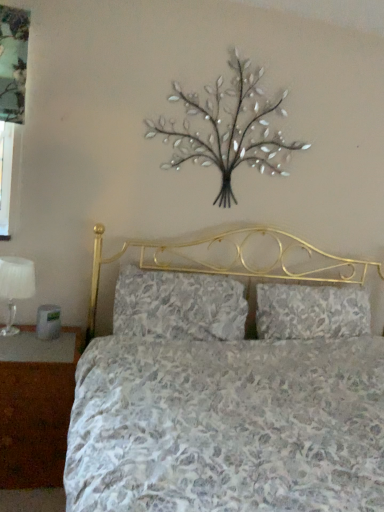
The width and height of the screenshot is (384, 512). I want to click on floral fabric pillow at center, which is counted as the first pillow, starting from the left, so click(178, 305).

This screenshot has height=512, width=384. I want to click on floral fabric pillow at center, placed as the second pillow when sorted from left to right, so click(x=311, y=311).

How distant is white fabric lampshade at left from metallic gray alarm clock at left?

7.32 inches.

Is white fabric lampshade at left far away from metallic gray alarm clock at left?

No, white fabric lampshade at left is not far from metallic gray alarm clock at left.

Find the location of a particular element. The width and height of the screenshot is (384, 512). silver below the white fabric lampshade at left (from the image's perspective) is located at coordinates (48, 322).

From the image's perspective, is white fabric lampshade at left under metallic gray alarm clock at left?

No, from the image's perspective, white fabric lampshade at left is not beneath metallic gray alarm clock at left.

From the picture: Is floral fabric pillow at center, placed as the second pillow when sorted from left to right, far from metallic silver tree at upper center?

floral fabric pillow at center, placed as the second pillow when sorted from left to right, is near metallic silver tree at upper center, not far away.

Is floral fabric pillow at center, the 1th pillow viewed from the right, bigger or smaller than metallic silver tree at upper center?

floral fabric pillow at center, the 1th pillow viewed from the right, is bigger than metallic silver tree at upper center.

Image resolution: width=384 pixels, height=512 pixels. What are the coordinates of `flower lying above the floral fabric pillow at center, placed as the second pillow when sorted from left to right (from the image's perspective)` in the screenshot? It's located at (228, 129).

Is the position of floral fabric pillow at center, placed as the second pillow when sorted from left to right, more distant than that of metallic silver tree at upper center?

Yes, it is behind metallic silver tree at upper center.

Which of these two, floral fabric pillow at center, the 1th pillow viewed from the right, or metallic gray alarm clock at left, is bigger?

floral fabric pillow at center, the 1th pillow viewed from the right.

Does floral fabric pillow at center, placed as the second pillow when sorted from left to right, have a greater height compared to metallic gray alarm clock at left?

Correct, floral fabric pillow at center, placed as the second pillow when sorted from left to right, is much taller as metallic gray alarm clock at left.

Could you tell me if floral fabric pillow at center, the 1th pillow viewed from the right, is turned towards metallic gray alarm clock at left?

No, floral fabric pillow at center, the 1th pillow viewed from the right, is not aimed at metallic gray alarm clock at left.

From the picture: Is floral fabric pillow at center, which is counted as the first pillow, starting from the left, far away from metallic silver tree at upper center?

floral fabric pillow at center, which is counted as the first pillow, starting from the left, is actually quite close to metallic silver tree at upper center.

From a real-world perspective, which is physically below, floral fabric pillow at center, which is counted as the first pillow, starting from the left, or metallic silver tree at upper center?

From a 3D spatial view, floral fabric pillow at center, which is counted as the first pillow, starting from the left, is below.

Considering the relative positions of floral fabric pillow at center, the second pillow from the right, and metallic silver tree at upper center in the image provided, is floral fabric pillow at center, the second pillow from the right, to the right of metallic silver tree at upper center from the viewer's perspective?

No.

In the image, is brown wood nightstand at lower left positioned in front of or behind floral fabric pillow at center, the second pillow from the right?

Visually, brown wood nightstand at lower left is located in front of floral fabric pillow at center, the second pillow from the right.

Is brown wood nightstand at lower left inside the boundaries of floral fabric pillow at center, the second pillow from the right, or outside?

brown wood nightstand at lower left is not enclosed by floral fabric pillow at center, the second pillow from the right.

From a real-world perspective, is brown wood nightstand at lower left on floral fabric pillow at center, which is counted as the first pillow, starting from the left?

No, from a real-world perspective, brown wood nightstand at lower left is not above floral fabric pillow at center, which is counted as the first pillow, starting from the left.

There is a metallic gray alarm clock at left. In order to click on the 2nd pillow above it (from the image's perspective) in this screenshot , I will do `click(178, 305)`.

How different are the orientations of metallic gray alarm clock at left and floral fabric pillow at center, which is counted as the first pillow, starting from the left, in degrees?

The angular difference between metallic gray alarm clock at left and floral fabric pillow at center, which is counted as the first pillow, starting from the left, is 1.88 degrees.

Is metallic gray alarm clock at left facing towards floral fabric pillow at center, the second pillow from the right?

No, metallic gray alarm clock at left is not aimed at floral fabric pillow at center, the second pillow from the right.

Is metallic gray alarm clock at left positioned far away from floral fabric pillow at center, which is counted as the first pillow, starting from the left?

No.

Is metallic gray alarm clock at left not close to metallic silver tree at upper center?

That's right, there is a large distance between metallic gray alarm clock at left and metallic silver tree at upper center.

Is metallic gray alarm clock at left to the left or to the right of metallic silver tree at upper center in the image?

Based on their positions, metallic gray alarm clock at left is located to the left of metallic silver tree at upper center.

From the image's perspective, between metallic gray alarm clock at left and metallic silver tree at upper center, who is located below?

metallic gray alarm clock at left, from the image's perspective.

Would you say metallic gray alarm clock at left is inside or outside metallic silver tree at upper center?

metallic gray alarm clock at left is outside metallic silver tree at upper center.

The width and height of the screenshot is (384, 512). In order to click on silver below the white fabric lampshade at left (from a real-world perspective) in this screenshot , I will do `click(48, 322)`.

In the image, there is a floral fabric pillow at center, the 1th pillow viewed from the right. Identify the location of flower above it (from the image's perspective). The height and width of the screenshot is (512, 384). (228, 129).

Which object lies further to the anchor point floral fabric pillow at center, the 1th pillow viewed from the right, metallic silver tree at upper center or white fabric lampshade at left?

white fabric lampshade at left.

Based on their spatial positions, is white fabric lampshade at left or floral fabric pillow at center, which is counted as the first pillow, starting from the left, closer to floral fabric pillow at center, the 1th pillow viewed from the right?

floral fabric pillow at center, which is counted as the first pillow, starting from the left, is positioned closer to the anchor floral fabric pillow at center, the 1th pillow viewed from the right.

From the image, which object appears to be farther from metallic silver tree at upper center, brown wood nightstand at lower left or floral fabric pillow at center, placed as the second pillow when sorted from left to right?

Based on the image, brown wood nightstand at lower left appears to be further to metallic silver tree at upper center.

Considering their positions, is metallic silver tree at upper center positioned closer to white fabric lampshade at left than metallic gray alarm clock at left?

metallic gray alarm clock at left is positioned closer to the anchor white fabric lampshade at left.

Considering their positions, is floral fabric pillow at center, placed as the second pillow when sorted from left to right, positioned closer to metallic gray alarm clock at left than metallic silver tree at upper center?

Based on the image, metallic silver tree at upper center appears to be nearer to metallic gray alarm clock at left.

Looking at the image, which one is located further to metallic silver tree at upper center, metallic gray alarm clock at left or floral fabric pillow at center, which is counted as the first pillow, starting from the left?

Based on the image, metallic gray alarm clock at left appears to be further to metallic silver tree at upper center.

Based on their spatial positions, is floral fabric pillow at center, the second pillow from the right, or white fabric lampshade at left closer to metallic gray alarm clock at left?

Among the two, white fabric lampshade at left is located nearer to metallic gray alarm clock at left.

Considering their positions, is metallic silver tree at upper center positioned further to floral fabric pillow at center, the 1th pillow viewed from the right, than brown wood nightstand at lower left?

Among the two, brown wood nightstand at lower left is located further to floral fabric pillow at center, the 1th pillow viewed from the right.

In order to click on pillow located between white fabric lampshade at left and floral fabric pillow at center, placed as the second pillow when sorted from left to right, in the left-right direction in this screenshot , I will do `click(178, 305)`.

Locate an element on the screen. This screenshot has width=384, height=512. silver between white fabric lampshade at left and floral fabric pillow at center, which is counted as the first pillow, starting from the left is located at coordinates (48, 322).

Locate an element on the screen. The width and height of the screenshot is (384, 512). pillow between metallic silver tree at upper center and floral fabric pillow at center, placed as the second pillow when sorted from left to right, vertically is located at coordinates (178, 305).

Where is `pillow between white fabric lampshade at left and metallic silver tree at upper center from left to right`? Image resolution: width=384 pixels, height=512 pixels. pillow between white fabric lampshade at left and metallic silver tree at upper center from left to right is located at coordinates (178, 305).